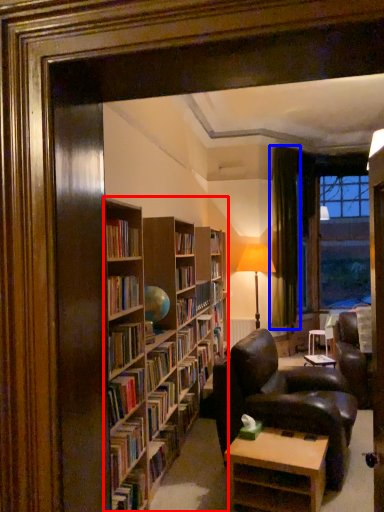
Question: Which of the following is the farthest to the observer, bookcase (highlighted by a red box) or curtain (highlighted by a blue box)?

Choices:
 (A) bookcase
 (B) curtain

Answer: (B)